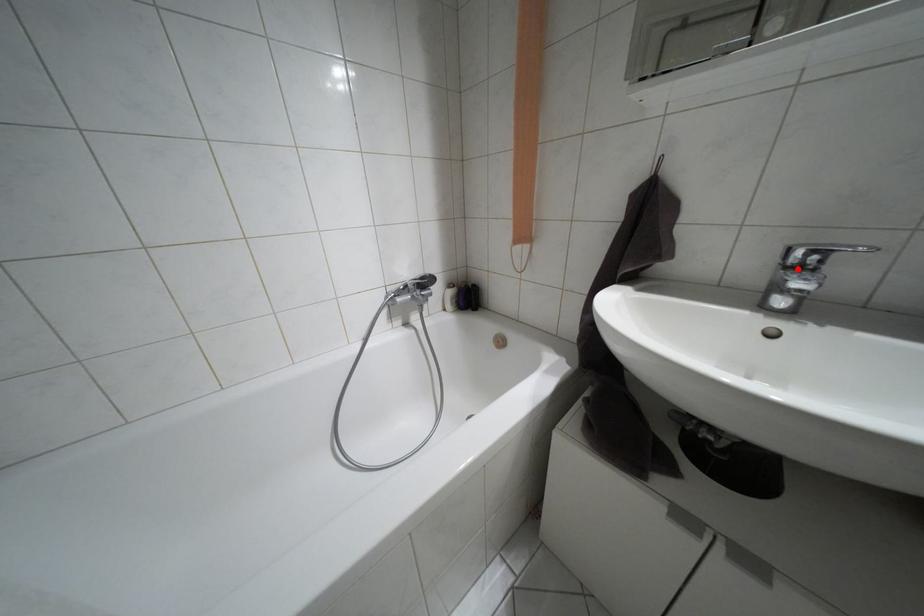
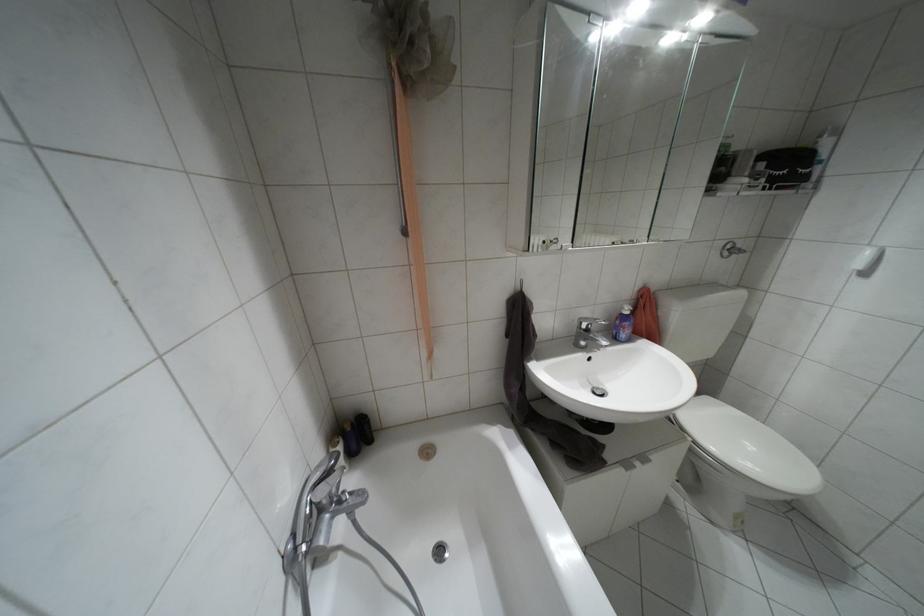
The point at the highlighted location is marked in the first image. Where is the corresponding point in the second image?

(587, 330)